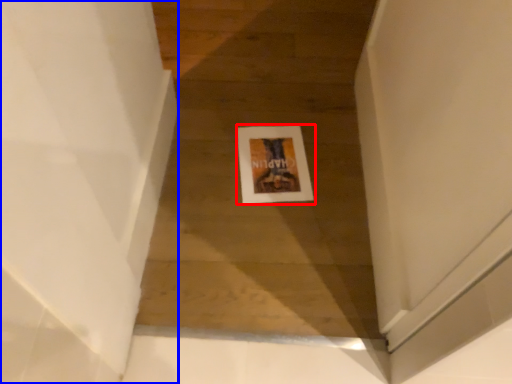
Question: Which point is further to the camera, picture frame (highlighted by a red box) or stairwell (highlighted by a blue box)?

Choices:
 (A) picture frame
 (B) stairwell

Answer: (A)